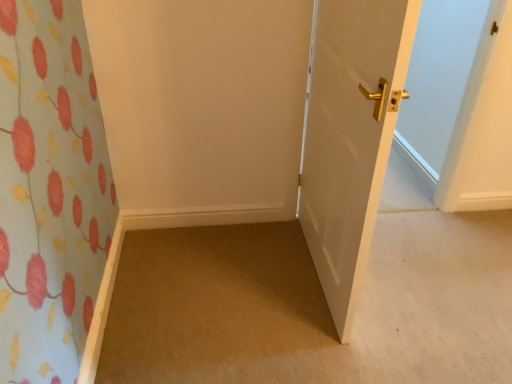
At what (x,y) coordinates should I click in order to perform the action: click on free point above carpet at lower left (from a real-world perspective). Please return your answer as a coordinate pair (x, y). Looking at the image, I should click on (320, 290).